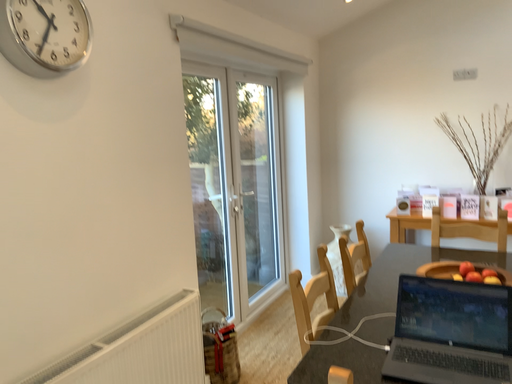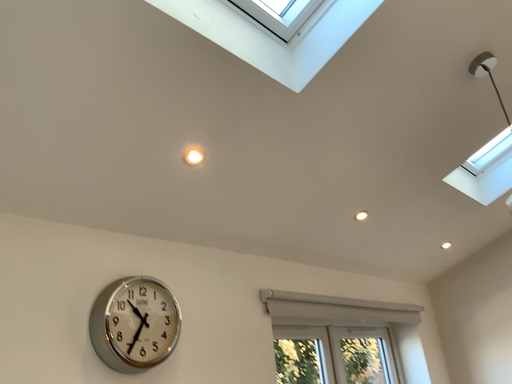
Question: How did the camera likely rotate when shooting the video?

Choices:
 (A) rotated right
 (B) rotated left

Answer: (B)